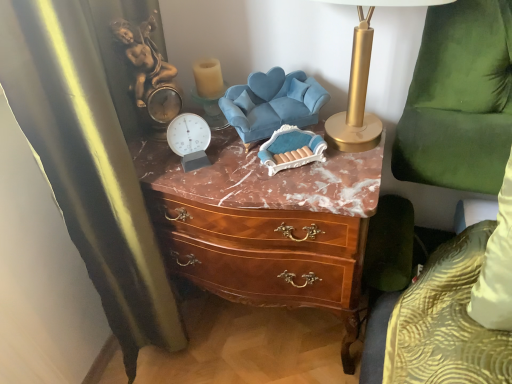
From the picture: What is the approximate height of velvet blue swivel chair at center, which is the 1th swivel chair from left to right?

velvet blue swivel chair at center, which is the 1th swivel chair from left to right, is 5.88 inches in height.

The width and height of the screenshot is (512, 384). Identify the location of translucent glass candle at upper center. (210, 91).

What do you see at coordinates (459, 99) in the screenshot?
I see `green velvet swivel chair at right, which is the 2th swivel chair from left to right` at bounding box center [459, 99].

Locate an element on the screen. gold metallic table lamp at upper right is located at coordinates (357, 97).

Looking at their sizes, would you say gold metallic table lamp at upper right is wider or thinner than translucent glass candle at upper center?

Considering their sizes, gold metallic table lamp at upper right looks broader than translucent glass candle at upper center.

Which is correct: gold metallic table lamp at upper right is inside translucent glass candle at upper center, or outside of it?

gold metallic table lamp at upper right cannot be found inside translucent glass candle at upper center.

From the image's perspective, is gold metallic table lamp at upper right on translucent glass candle at upper center?

Answer: No, from the image's perspective, gold metallic table lamp at upper right is not over translucent glass candle at upper center.

Which of these two, gold metallic table lamp at upper right or translucent glass candle at upper center, stands taller?

gold metallic table lamp at upper right is taller.

Is velvet blue swivel chair at center, which is the 1th swivel chair from left to right, facing away from brown wood chest of drawers at center?

No, brown wood chest of drawers at center is not at the back of velvet blue swivel chair at center, which is the 1th swivel chair from left to right.

From a real-world perspective, is velvet blue swivel chair at center, acting as the 2th swivel chair starting from the right, physically located above or below brown wood chest of drawers at center?

velvet blue swivel chair at center, acting as the 2th swivel chair starting from the right, is above brown wood chest of drawers at center.

Looking at this image, measure the distance between velvet blue swivel chair at center, which is the 1th swivel chair from left to right, and brown wood chest of drawers at center.

velvet blue swivel chair at center, which is the 1th swivel chair from left to right, is 8.77 inches from brown wood chest of drawers at center.

From the image's perspective, which is above, velvet blue swivel chair at center, acting as the 2th swivel chair starting from the right, or brown wood chest of drawers at center?

From the image's view, velvet blue swivel chair at center, acting as the 2th swivel chair starting from the right, is above.

Based on their sizes in the image, would you say metallic silver clock at center is bigger or smaller than black velvet curtain at left?

In the image, metallic silver clock at center appears to be smaller than black velvet curtain at left.

From the image's perspective, is metallic silver clock at center located beneath black velvet curtain at left?

No, from the image's perspective, metallic silver clock at center is not below black velvet curtain at left.

Is black velvet curtain at left at the back of metallic silver clock at center?

Yes.

Based on the photo, measure the distance between metallic silver clock at center and black velvet curtain at left.

metallic silver clock at center and black velvet curtain at left are 11.25 inches apart.

Is black velvet curtain at left positioned beyond the bounds of velvet blue swivel chair at center, acting as the 2th swivel chair starting from the right?

Yes.

Where is `curtain that is below the velvet blue swivel chair at center, which is the 1th swivel chair from left to right (from the image's perspective)`? curtain that is below the velvet blue swivel chair at center, which is the 1th swivel chair from left to right (from the image's perspective) is located at coordinates (91, 155).

Who is bigger, black velvet curtain at left or velvet blue swivel chair at center, acting as the 2th swivel chair starting from the right?

black velvet curtain at left.

Could you tell me if black velvet curtain at left is facing velvet blue swivel chair at center, acting as the 2th swivel chair starting from the right?

Yes, black velvet curtain at left is oriented towards velvet blue swivel chair at center, acting as the 2th swivel chair starting from the right.

Considering the relative sizes of brown wood chest of drawers at center and green velvet swivel chair at right, which is the 2th swivel chair from left to right, in the image provided, is brown wood chest of drawers at center wider than green velvet swivel chair at right, which is the 2th swivel chair from left to right,?

Correct, the width of brown wood chest of drawers at center exceeds that of green velvet swivel chair at right, which is the 2th swivel chair from left to right.

Between brown wood chest of drawers at center and green velvet swivel chair at right, which is the 1th swivel chair from right to left, which one has more height?

Standing taller between the two is green velvet swivel chair at right, which is the 1th swivel chair from right to left.

From a real-world perspective, who is located lower, brown wood chest of drawers at center or green velvet swivel chair at right, which is the 1th swivel chair from right to left?

brown wood chest of drawers at center, from a real-world perspective.

Image resolution: width=512 pixels, height=384 pixels. What are the coordinates of `swivel chair in front of the brown wood chest of drawers at center` in the screenshot? It's located at (459, 99).

Which is more to the right, black velvet curtain at left or green velvet swivel chair at right, which is the 1th swivel chair from right to left?

Positioned to the right is green velvet swivel chair at right, which is the 1th swivel chair from right to left.

Is black velvet curtain at left positioned before green velvet swivel chair at right, which is the 1th swivel chair from right to left?

Yes, black velvet curtain at left is closer to the viewer.

Is the surface of black velvet curtain at left in direct contact with metallic silver clock at center?

No, black velvet curtain at left is not in contact with metallic silver clock at center.

Which object is thinner, black velvet curtain at left or metallic silver clock at center?

metallic silver clock at center is thinner.

How distant is black velvet curtain at left from metallic silver clock at center?

black velvet curtain at left and metallic silver clock at center are 11.25 inches apart from each other.

Is the position of black velvet curtain at left less distant than that of metallic silver clock at center?

Yes, black velvet curtain at left is closer to the camera.

This screenshot has width=512, height=384. In order to click on table lamp above the translucent glass candle at upper center (from a real-world perspective) in this screenshot , I will do `click(357, 97)`.

Where is `chest of drawers lying on the right of velvet blue swivel chair at center, acting as the 2th swivel chair starting from the right`? This screenshot has width=512, height=384. chest of drawers lying on the right of velvet blue swivel chair at center, acting as the 2th swivel chair starting from the right is located at coordinates (265, 225).

From the image, which object appears to be nearer to gold metallic table lamp at upper right, translucent glass candle at upper center or metallic silver clock at center?

translucent glass candle at upper center is positioned closer to the anchor gold metallic table lamp at upper right.

Considering their positions, is metallic silver clock at center positioned further to gold metallic table lamp at upper right than translucent glass candle at upper center?

metallic silver clock at center is positioned further to the anchor gold metallic table lamp at upper right.

When comparing their distances from brown wood chest of drawers at center, does translucent glass candle at upper center or velvet blue swivel chair at center, acting as the 2th swivel chair starting from the right, seem closer?

The object closer to brown wood chest of drawers at center is velvet blue swivel chair at center, acting as the 2th swivel chair starting from the right.

Considering their positions, is metallic silver clock at center positioned closer to brown wood chest of drawers at center than gold metallic table lamp at upper right?

The object closer to brown wood chest of drawers at center is metallic silver clock at center.

Considering their positions, is gold metallic table lamp at upper right positioned further to translucent glass candle at upper center than black velvet curtain at left?

Based on the image, black velvet curtain at left appears to be further to translucent glass candle at upper center.

When comparing their distances from metallic silver clock at center, does green velvet swivel chair at right, which is the 2th swivel chair from left to right, or velvet blue swivel chair at center, acting as the 2th swivel chair starting from the right, seem closer?

Among the two, velvet blue swivel chair at center, acting as the 2th swivel chair starting from the right, is located nearer to metallic silver clock at center.

Based on their spatial positions, is metallic silver clock at center or black velvet curtain at left further from brown wood chest of drawers at center?

The object further to brown wood chest of drawers at center is black velvet curtain at left.

Which object lies nearer to the anchor point green velvet swivel chair at right, which is the 2th swivel chair from left to right, gold metallic table lamp at upper right or brown wood chest of drawers at center?

The object closer to green velvet swivel chair at right, which is the 2th swivel chair from left to right, is gold metallic table lamp at upper right.

Where is `swivel chair situated between translucent glass candle at upper center and gold metallic table lamp at upper right from left to right`? swivel chair situated between translucent glass candle at upper center and gold metallic table lamp at upper right from left to right is located at coordinates (272, 103).

At what (x,y) coordinates should I click in order to perform the action: click on the chest of drawers situated between velvet blue swivel chair at center, acting as the 2th swivel chair starting from the right, and green velvet swivel chair at right, which is the 1th swivel chair from right to left, from left to right. Please return your answer as a coordinate pair (x, y). This screenshot has height=384, width=512. Looking at the image, I should click on (265, 225).

Locate an element on the screen. The height and width of the screenshot is (384, 512). chest of drawers between black velvet curtain at left and velvet blue swivel chair at center, which is the 1th swivel chair from left to right, from front to back is located at coordinates (265, 225).

You are a GUI agent. You are given a task and a screenshot of the screen. Output one action in this format:
    pyautogui.click(x=<x>, y=<y>)
    Task: Click on the clock between velvet blue swivel chair at center, which is the 1th swivel chair from left to right, and brown wood chest of drawers at center vertically
    This screenshot has width=512, height=384.
    Given the screenshot: What is the action you would take?
    pyautogui.click(x=189, y=140)